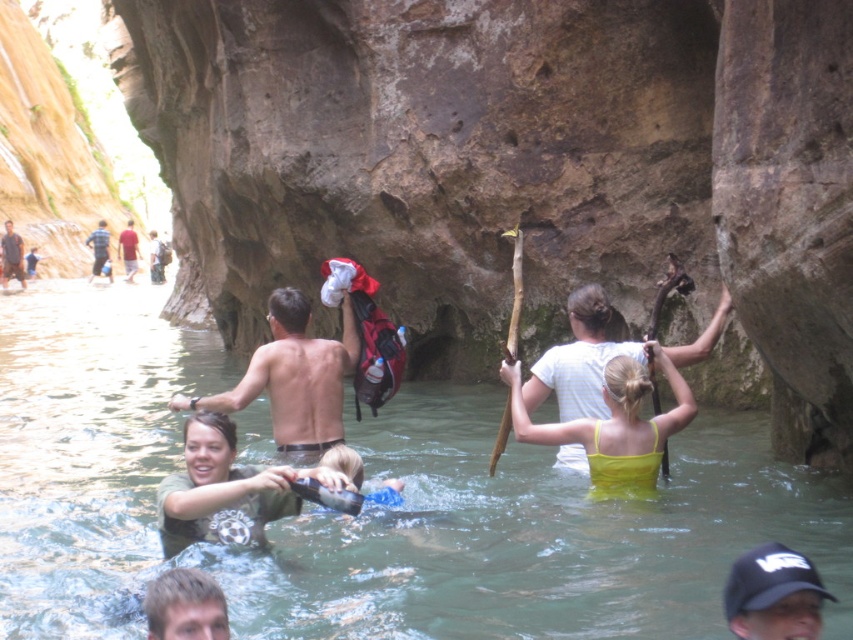
Does green matte shirt at center come behind blonde hair at lower left?

Yes, green matte shirt at center is behind blonde hair at lower left.

Does green matte shirt at center have a lesser width compared to blonde hair at lower left?

Yes.

Who is more forward, (250, 465) or (215, 618)?

Point (215, 618) is more forward.

The height and width of the screenshot is (640, 853). Find the location of `green matte shirt at center`. green matte shirt at center is located at coordinates (225, 490).

Is green matte shirt at center further to camera compared to light brown leather backpack at center?

No, green matte shirt at center is closer to the viewer.

Is point (173, 483) closer to camera compared to point (151, 253)?

That is True.

Measure the distance between green matte shirt at center and camera.

The distance of green matte shirt at center from camera is 33.78 meters.

You are a GUI agent. You are given a task and a screenshot of the screen. Output one action in this format:
    pyautogui.click(x=<x>, y=<y>)
    Task: Click on the green matte shirt at center
    This screenshot has width=853, height=640.
    Given the screenshot: What is the action you would take?
    tap(225, 490)

Between shiny metallic backpack at center and green matte shirt at center, which one appears on the right side from the viewer's perspective?

From the viewer's perspective, green matte shirt at center appears more on the right side.

Is the position of shiny metallic backpack at center less distant than that of green matte shirt at center?

That is False.

Between point (260, 374) and point (264, 508), which one is positioned in front?

Point (264, 508) is more forward.

Locate an element on the screen. shiny metallic backpack at center is located at coordinates (x=293, y=378).